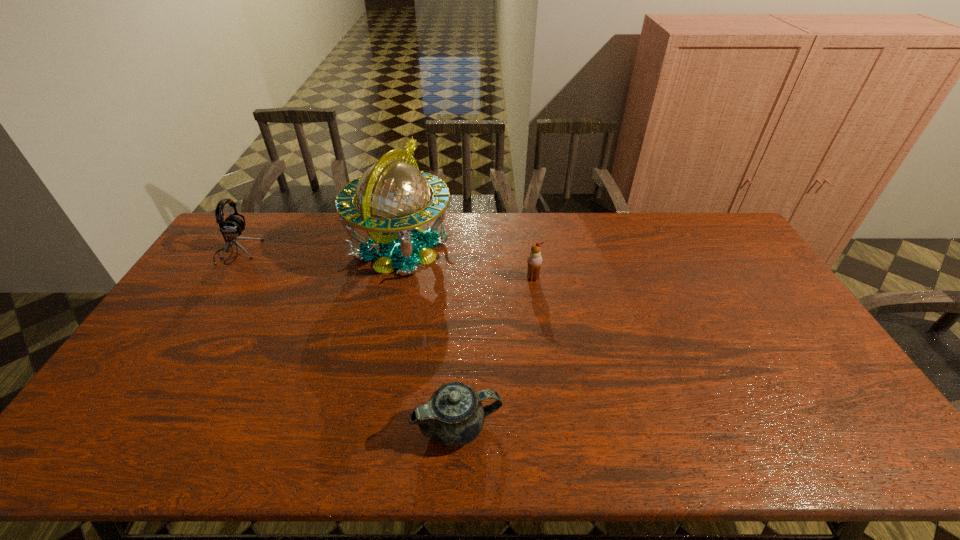
Identify the location of free space that is in between the earphone and the nearest object. This screenshot has height=540, width=960. (348, 340).

This screenshot has width=960, height=540. Identify the location of vacant space that is in between the icecream and the nearest object. (495, 352).

Locate an element on the screen. This screenshot has width=960, height=540. vacant space in between the chinaware and the tallest object is located at coordinates (430, 338).

This screenshot has height=540, width=960. I want to click on unoccupied area between the tallest object and the second tallest object, so click(x=319, y=251).

Locate an element on the screen. The image size is (960, 540). free spot between the chinaware and the earphone is located at coordinates (348, 340).

The image size is (960, 540). In order to click on unoccupied position between the icecream and the chinaware in this screenshot , I will do `click(495, 352)`.

The height and width of the screenshot is (540, 960). I want to click on the closest object to the icecream, so click(393, 197).

At what (x,y) coordinates should I click in order to perform the action: click on object that is the third closest to the rightmost object. Please return your answer as a coordinate pair (x, y). The height and width of the screenshot is (540, 960). Looking at the image, I should click on (232, 227).